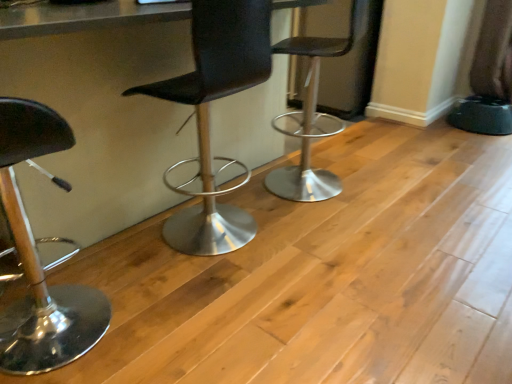
Question: Looking at their shapes, would you say shiny black stool at left, the 1th chair positioned from the left, is wider or thinner than black leather stool at center, the third chair viewed from the left?

Choices:
 (A) thin
 (B) wide

Answer: (A)

Question: Relative to black leather stool at center, the third chair viewed from the left, is shiny black stool at left, the 1th chair positioned from the left, in front or behind?

Choices:
 (A) front
 (B) behind

Answer: (A)

Question: Which of these objects is positioned closest to the black leather chair at center, positioned as the second chair in right-to-left order?

Choices:
 (A) shiny black stool at left, the third chair positioned from the right
 (B) black leather stool at center, the third chair viewed from the left
 (C) metallic gray table at center

Answer: (C)

Question: Estimate the real-world distances between objects in this image. Which object is closer to the black leather stool at center, the third chair viewed from the left?

Choices:
 (A) metallic gray table at center
 (B) black leather chair at center, which is the 2th chair in left-to-right order
 (C) shiny black stool at left, the 1th chair positioned from the left

Answer: (B)